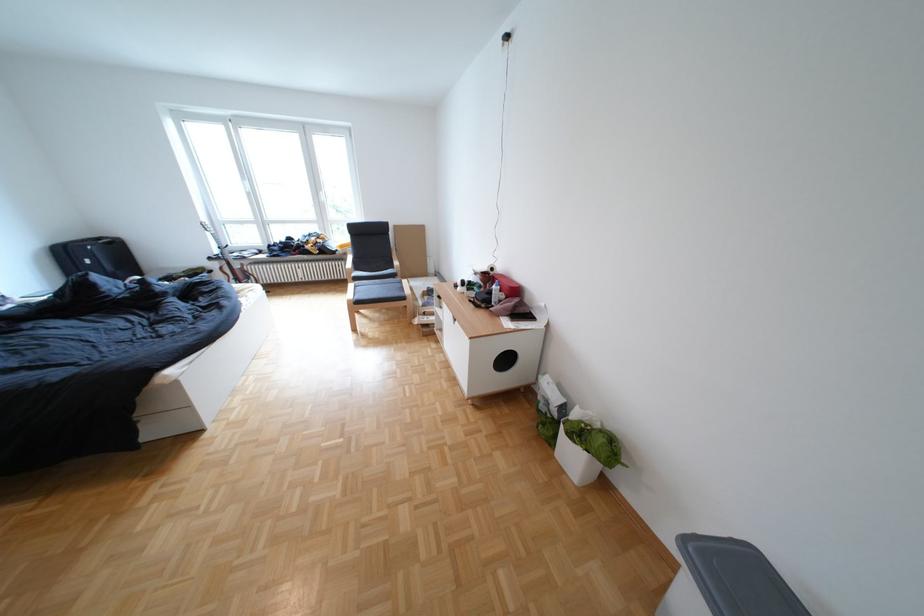
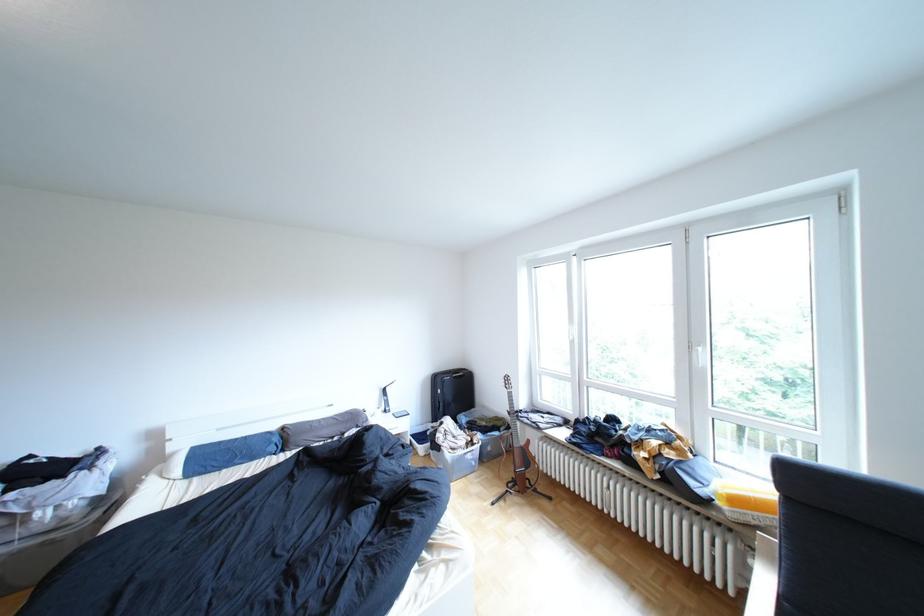
Find the pixel in the second image that matches [253,273] in the first image.

(532, 453)